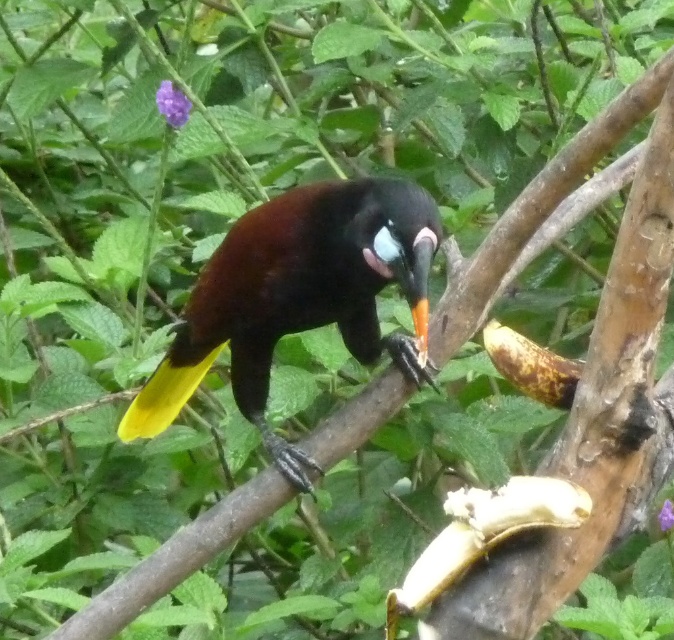
You are a photographer aiming to capture the shiny black bird at center and the yellow matte banana at lower right in a single frame. Based on their positions, which object should you adjust your camera focus on first to ensure both are in the frame?

The shiny black bird at center is to the left of the yellow matte banana at lower right, so you should focus on the shiny black bird at center first to ensure both are within the frame.

You are an ornithologist observing the scene. You need to determine which object is bigger between the shiny black bird at center and the yellow matte banana at lower right. Which one is larger?

The shiny black bird at center is larger than the yellow matte banana at lower right according to the description.